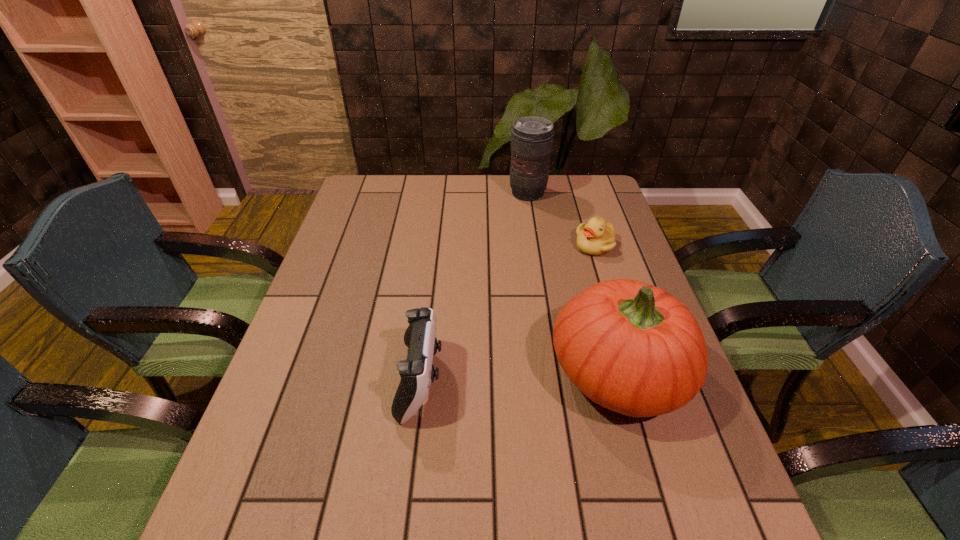
The width and height of the screenshot is (960, 540). Identify the location of free space on the desktop that is between the leftmost object and the pumpkin and is positioned on the beak of the duckling. (540, 376).

I want to click on vacant space on the desktop that is between the third tallest object and the pumpkin and is positioned on the side of the telephoto lens where the control switches are located, so point(496,377).